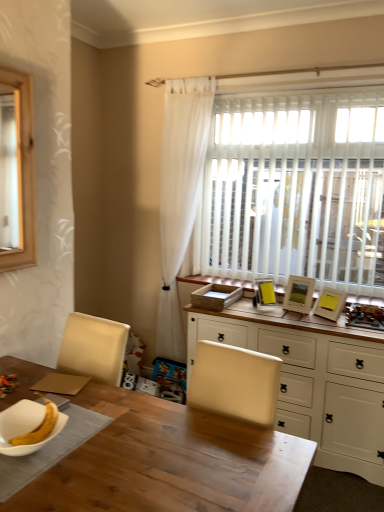
Where is `free space to the right of white glossy bowl at lower left`? free space to the right of white glossy bowl at lower left is located at coordinates (95, 446).